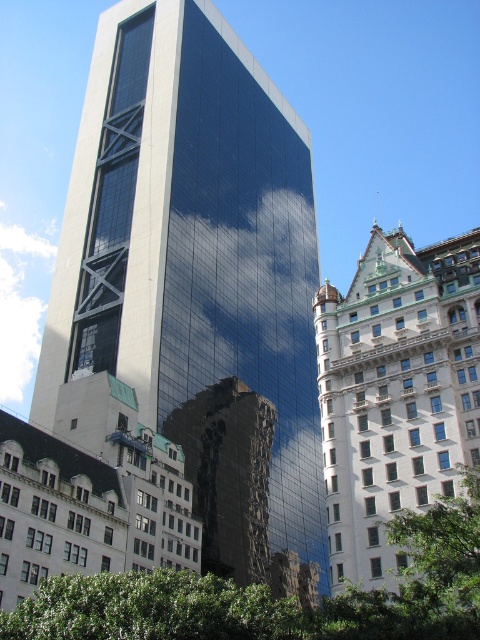
Question: Observing the image, what is the correct spatial positioning of shiny glass skyscraper at center in reference to white stone building at right?

Choices:
 (A) below
 (B) above

Answer: (B)

Question: Which point is farther to the camera?

Choices:
 (A) white stone building at right
 (B) reflective glass building at center

Answer: (B)

Question: Can you confirm if shiny glass skyscraper at center is wider than reflective glass building at center?

Choices:
 (A) yes
 (B) no

Answer: (A)

Question: Which point appears closest to the camera in this image?

Choices:
 (A) (238, 508)
 (B) (275, 572)

Answer: (A)

Question: Among these points, which one is farthest from the camera?

Choices:
 (A) (254, 419)
 (B) (342, 392)

Answer: (A)

Question: Is shiny glass skyscraper at center to the right of white stone building at right from the viewer's perspective?

Choices:
 (A) yes
 (B) no

Answer: (B)